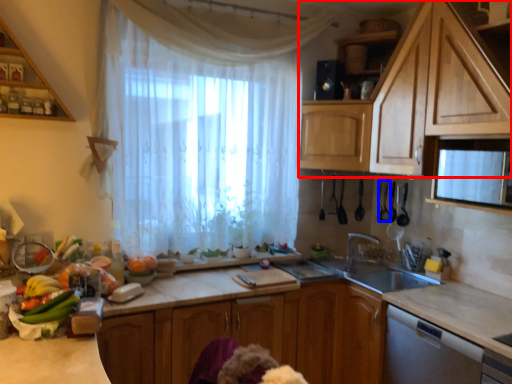
Question: Which object is closer to the camera taking this photo, cabinetry (highlighted by a red box) or appliance (highlighted by a blue box)?

Choices:
 (A) cabinetry
 (B) appliance

Answer: (A)